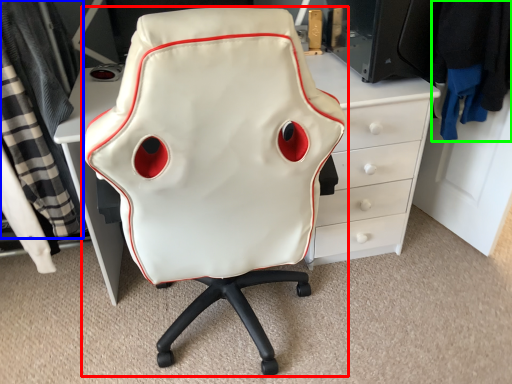
Question: Based on their relative distances, which object is farther from chair (highlighted by a red box)? Choose from clothing (highlighted by a blue box) and clothing (highlighted by a green box).

Choices:
 (A) clothing
 (B) clothing

Answer: (B)